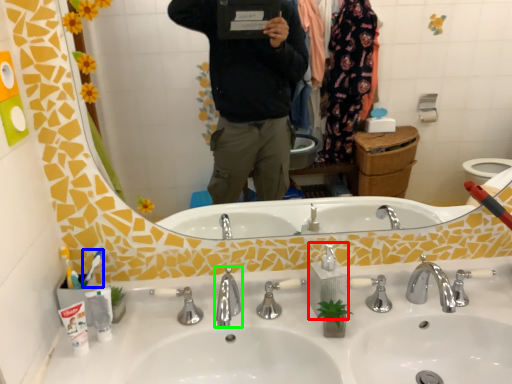
Question: Which object is positioned closest to soap dispenser (highlighted by a red box)? Select from toothbrush (highlighted by a blue box) and tap (highlighted by a green box).

Choices:
 (A) toothbrush
 (B) tap

Answer: (B)